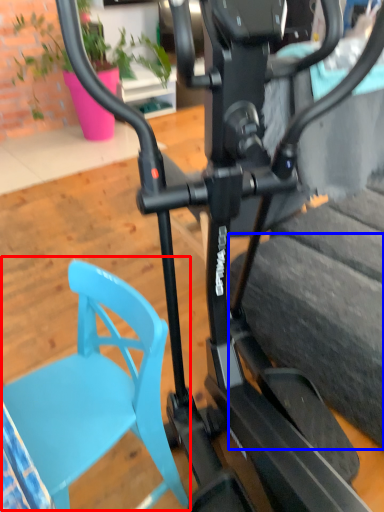
Question: Which point is further to the camera, swivel chair (highlighted by a red box) or tire (highlighted by a blue box)?

Choices:
 (A) swivel chair
 (B) tire

Answer: (B)